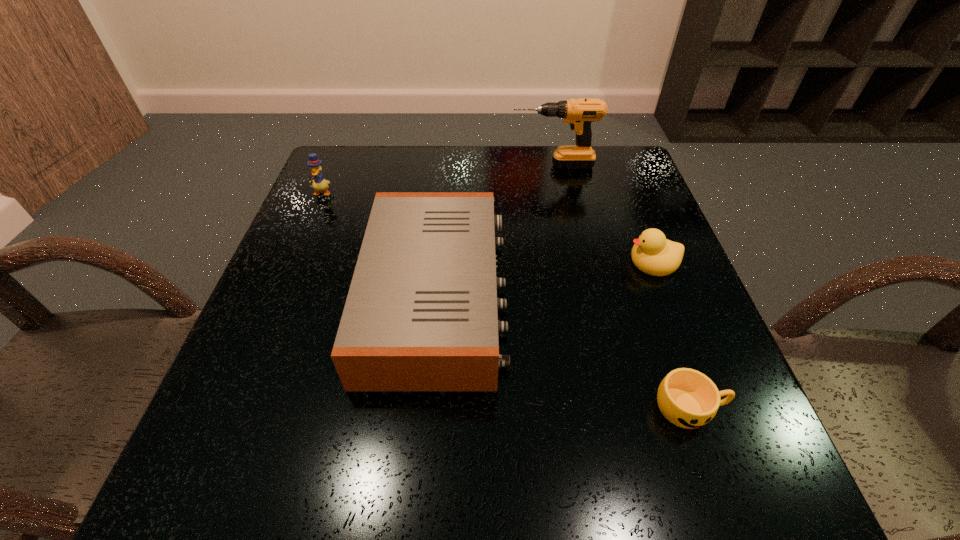
Choose which object is the third nearest neighbor to the taller duckling. Please provide its 2D coordinates. Your answer should be formatted as a tuple, i.e. [(x, y)], where the tuple contains the x and y coordinates of a point satisfying the conditions above.

[(653, 254)]

This screenshot has width=960, height=540. I want to click on the fourth closest object to the shortest object, so click(319, 183).

This screenshot has height=540, width=960. What are the coordinates of `vacant point that satisfies the following two spatial constraints: 1. at the tip of the shortest object; 2. on the left side of the tallest object` in the screenshot? It's located at (603, 407).

Where is `free point that satisfies the following two spatial constraints: 1. on the front panel of the fourth object from right to left; 2. on the left side of the shortest object`? The image size is (960, 540). free point that satisfies the following two spatial constraints: 1. on the front panel of the fourth object from right to left; 2. on the left side of the shortest object is located at coordinates (426, 407).

This screenshot has width=960, height=540. What are the coordinates of `vacant space that satisfies the following two spatial constraints: 1. at the tip of the tallest object; 2. on the face of the left duckling, where the monocle is placed` in the screenshot? It's located at (558, 193).

Identify the location of free space that satisfies the following two spatial constraints: 1. at the tip of the drill; 2. on the face of the fourth nearest object, where the monocle is placed. The width and height of the screenshot is (960, 540). tap(558, 193).

This screenshot has height=540, width=960. Identify the location of free space that satisfies the following two spatial constraints: 1. at the tip of the tallest object; 2. on the left side of the cup. (603, 407).

The image size is (960, 540). In order to click on free space that satisfies the following two spatial constraints: 1. on the front panel of the shortest object; 2. on the right side of the fourth object from right to left in this screenshot , I will do `click(426, 407)`.

Find the location of a particular element. Image resolution: width=960 pixels, height=540 pixels. vacant space that satisfies the following two spatial constraints: 1. at the tip of the farthest object; 2. on the left side of the shortest object is located at coordinates 603,407.

This screenshot has height=540, width=960. Find the location of `free space that satisfies the following two spatial constraints: 1. on the front panel of the shortest object; 2. on the left side of the fourth object from right to left`. free space that satisfies the following two spatial constraints: 1. on the front panel of the shortest object; 2. on the left side of the fourth object from right to left is located at coordinates (426, 407).